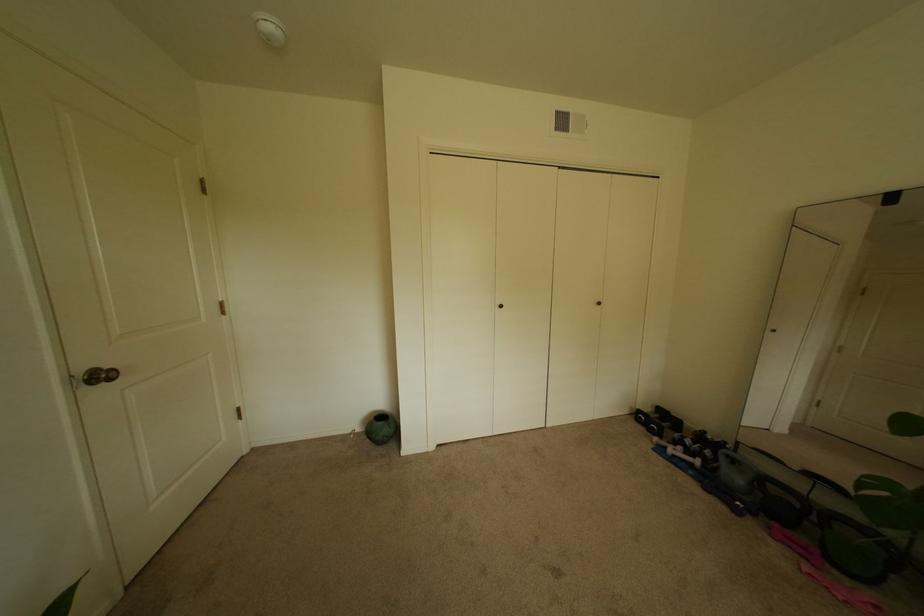
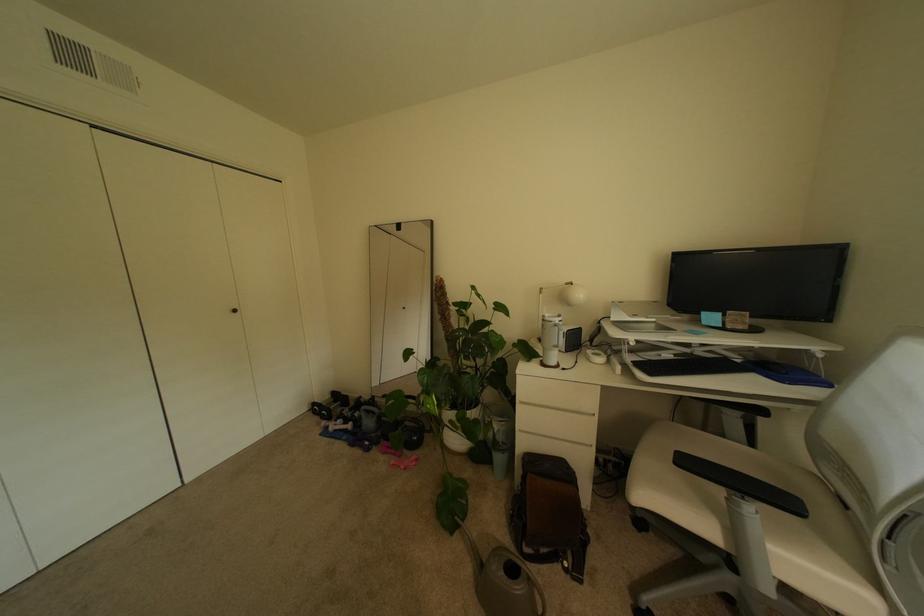
Question: The images are taken continuously from a first-person perspective. In which direction is your viewpoint rotating?

Choices:
 (A) Left
 (B) Right
 (C) Up
 (D) Down

Answer: (B)